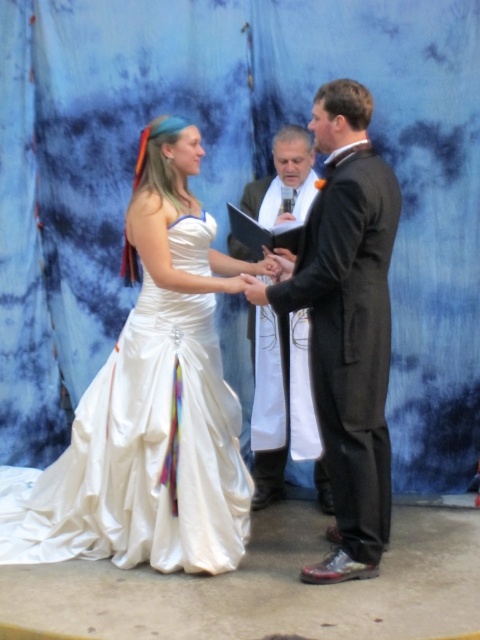
You are a photographer at a wedding. You need to adjust your camera focus to capture both the white satin dress at center and the shiny black suit at center clearly. Since the two are at different distances from you, which one should you focus on first to ensure the closest subject is sharp?

The white satin dress at center is closer to you than the shiny black suit at center, so you should focus on the white satin dress at center first to ensure it is sharp before adjusting for the other subject.

You are a photographer at the wedding ceremony. You need to position yourself so that the shiny black suit at center and the black satin suit at center are both in frame. Which direction should you move to ensure both suits are visible?

You should move to the left to ensure both the shiny black suit at center and the black satin suit at center are visible, as the shiny black suit at center is to the right of the black satin suit at center.

You are a photographer at a wedding. You need to position yourself so that both the white satin dress at center and the shiny black suit at center are fully visible in your shot. Which object should you ensure is closer to the edge of the frame to avoid being cut off?

The white satin dress at center is wider than the shiny black suit at center. To avoid being cut off, you should position the white satin dress at center closer to the edge of the frame since it is wider and requires more space.